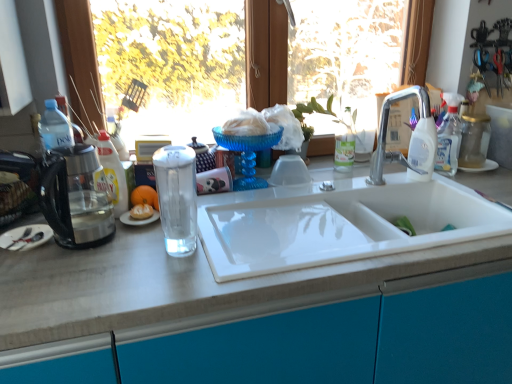
This screenshot has height=384, width=512. Identify the location of vacant area to the right of white matte plate at left. (96, 254).